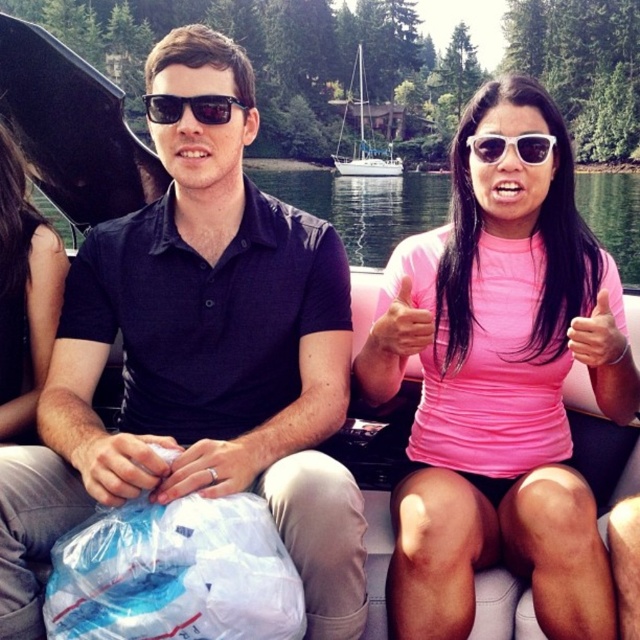
You are a photographer on a neighboring boat and want to take a photo of the pink matte shirt at center and the white sailboat at center. Based on their positions, which object should you adjust your camera to focus on first to ensure both are in the frame?

The pink matte shirt at center is positioned on the left side of white sailboat at center, so you should focus on the white sailboat at center first to ensure both the pink matte shirt at center and the white sailboat at center are captured in the frame.

From the picture: You are navigating a drone to take a photo of the scene. The drone is currently at the center of the image. Which direction should you move the drone to get a better view of the pink matte shirt at center?

The pink matte shirt at center is located at point 0.600 on the x and 0.783 on the y. Since the drone is at the center, which is point 0.5 on both axes, you should move the drone slightly to the right and upwards to align with the pink matte shirt at center.

Consider the image. You are on a boat and want to hand a snack to the person wearing the pink matte shirt at center and the white sailboat at center. Which one can you reach first without moving?

The pink matte shirt at center is closer to the viewer than the white sailboat at center, so you can reach the person wearing the pink matte shirt at center first.